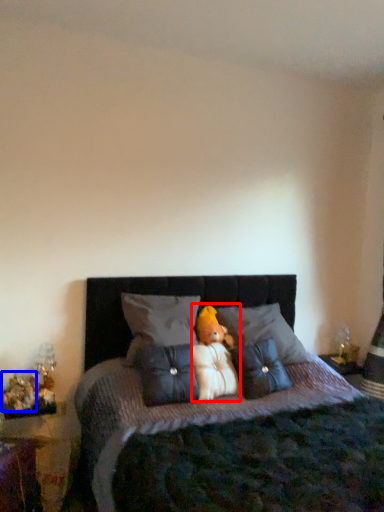
Question: Which of the following is the farthest to the observer, doll (highlighted by a red box) or toy (highlighted by a blue box)?

Choices:
 (A) doll
 (B) toy

Answer: (A)